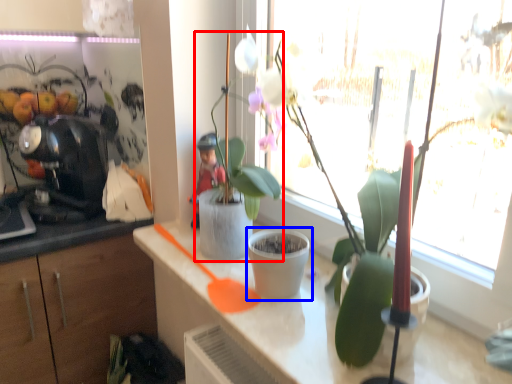
Question: Among these objects, which one is farthest to the camera, houseplant (highlighted by a red box) or flowerpot (highlighted by a blue box)?

Choices:
 (A) houseplant
 (B) flowerpot

Answer: (B)